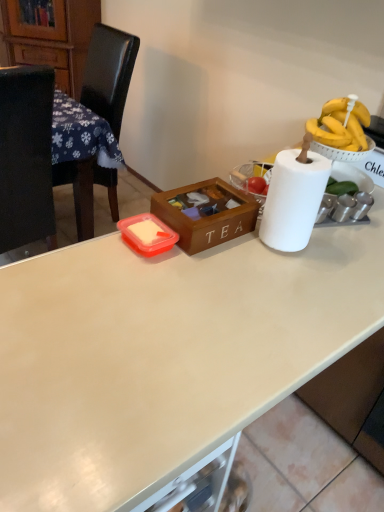
Question: Is black leather chair at left thinner than white matte desk at center?

Choices:
 (A) yes
 (B) no

Answer: (A)

Question: Does black leather chair at left have a larger size compared to white matte desk at center?

Choices:
 (A) yes
 (B) no

Answer: (B)

Question: Could you tell me if black leather chair at left is facing white matte desk at center?

Choices:
 (A) no
 (B) yes

Answer: (A)

Question: Are black leather chair at left and white matte desk at center located far from each other?

Choices:
 (A) yes
 (B) no

Answer: (A)

Question: Is black leather chair at left wider than white matte desk at center?

Choices:
 (A) yes
 (B) no

Answer: (B)

Question: Looking at their shapes, would you say wooden tea box at center is wider or thinner than white matte table at left?

Choices:
 (A) wide
 (B) thin

Answer: (B)

Question: From the image's perspective, is wooden tea box at center located above or below white matte table at left?

Choices:
 (A) above
 (B) below

Answer: (B)

Question: Is wooden tea box at center bigger or smaller than white matte table at left?

Choices:
 (A) big
 (B) small

Answer: (B)

Question: Considering the relative positions of wooden tea box at center and white matte table at left in the image provided, is wooden tea box at center to the left or to the right of white matte table at left?

Choices:
 (A) right
 (B) left

Answer: (A)

Question: Considering the positions of wooden cabinet at left and white matte table at left in the image, is wooden cabinet at left wider or thinner than white matte table at left?

Choices:
 (A) thin
 (B) wide

Answer: (A)

Question: Based on their positions, is wooden cabinet at left located to the left or right of white matte table at left?

Choices:
 (A) left
 (B) right

Answer: (A)

Question: Would you say wooden cabinet at left is inside or outside white matte table at left?

Choices:
 (A) outside
 (B) inside

Answer: (A)

Question: Relative to white matte table at left, is wooden cabinet at left in front or behind?

Choices:
 (A) front
 (B) behind

Answer: (B)

Question: Is point (105, 123) closer or farther from the camera than point (218, 188)?

Choices:
 (A) farther
 (B) closer

Answer: (A)

Question: From a real-world perspective, is white matte table at left above or below wooden tea box at center?

Choices:
 (A) above
 (B) below

Answer: (B)